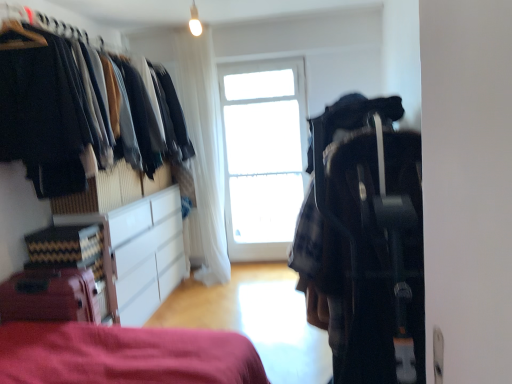
Question: Is white glossy cabinet at lower left to the left of plaid fabric backpack at center right from the viewer's perspective?

Choices:
 (A) no
 (B) yes

Answer: (B)

Question: Can you confirm if white glossy cabinet at lower left is taller than plaid fabric backpack at center right?

Choices:
 (A) yes
 (B) no

Answer: (B)

Question: From the image's perspective, is white glossy cabinet at lower left beneath plaid fabric backpack at center right?

Choices:
 (A) yes
 (B) no

Answer: (A)

Question: Is the position of white glossy cabinet at lower left less distant than that of plaid fabric backpack at center right?

Choices:
 (A) yes
 (B) no

Answer: (B)

Question: Considering the relative sizes of white glossy cabinet at lower left and plaid fabric backpack at center right in the image provided, is white glossy cabinet at lower left smaller than plaid fabric backpack at center right?

Choices:
 (A) no
 (B) yes

Answer: (B)

Question: Could you tell me if white glossy cabinet at lower left is facing plaid fabric backpack at center right?

Choices:
 (A) yes
 (B) no

Answer: (A)

Question: Is transparent glass window at center oriented towards matte red suitcase at lower left?

Choices:
 (A) no
 (B) yes

Answer: (A)

Question: Considering the relative sizes of transparent glass window at center and matte red suitcase at lower left in the image provided, is transparent glass window at center shorter than matte red suitcase at lower left?

Choices:
 (A) no
 (B) yes

Answer: (A)

Question: From the image's perspective, is transparent glass window at center below matte red suitcase at lower left?

Choices:
 (A) yes
 (B) no

Answer: (B)

Question: Considering the relative sizes of transparent glass window at center and matte red suitcase at lower left in the image provided, is transparent glass window at center taller than matte red suitcase at lower left?

Choices:
 (A) no
 (B) yes

Answer: (B)

Question: Are transparent glass window at center and matte red suitcase at lower left far apart?

Choices:
 (A) no
 (B) yes

Answer: (B)

Question: From a real-world perspective, is transparent glass window at center physically above matte red suitcase at lower left?

Choices:
 (A) yes
 (B) no

Answer: (A)

Question: From a real-world perspective, is matte red suitcase at lower left located higher than plaid fabric backpack at center right?

Choices:
 (A) yes
 (B) no

Answer: (B)